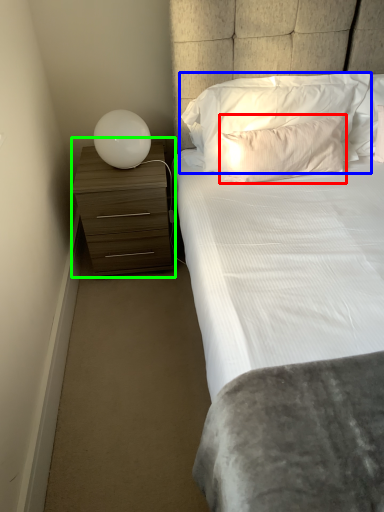
Question: Which object is positioned closest to pillow (highlighted by a red box)? Select from pillow (highlighted by a blue box) and chest of drawers (highlighted by a green box).

Choices:
 (A) pillow
 (B) chest of drawers

Answer: (A)